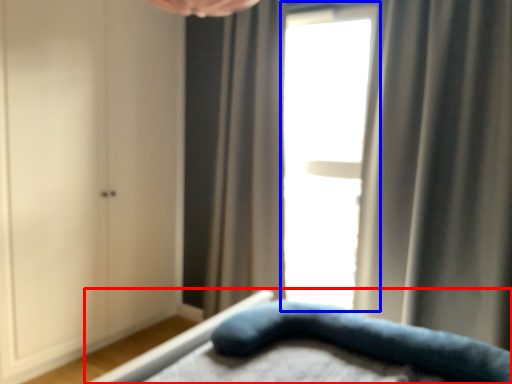
Question: Among these objects, which one is farthest to the camera, bed (highlighted by a red box) or window (highlighted by a blue box)?

Choices:
 (A) bed
 (B) window

Answer: (B)